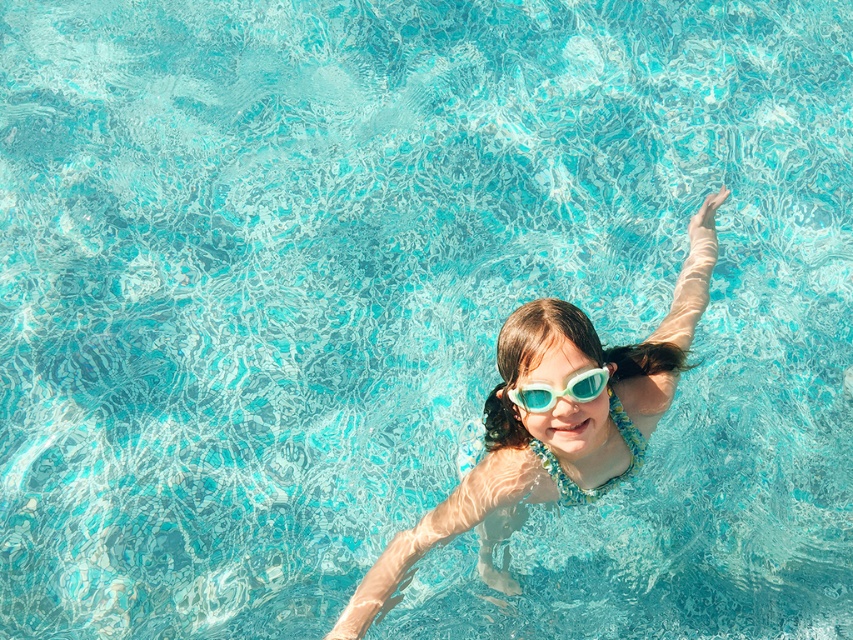
Question: Which point is closer to the camera taking this photo?

Choices:
 (A) (664, 336)
 (B) (527, 406)

Answer: (B)

Question: Among these points, which one is nearest to the camera?

Choices:
 (A) (628, 397)
 (B) (589, 380)

Answer: (B)

Question: Can you confirm if translucent plastic goggles at center is wider than clear plastic goggles at center?

Choices:
 (A) no
 (B) yes

Answer: (B)

Question: Is translucent plastic goggles at center smaller than clear plastic goggles at center?

Choices:
 (A) no
 (B) yes

Answer: (A)

Question: Which point is closer to the camera?

Choices:
 (A) translucent plastic goggles at center
 (B) clear plastic goggles at center

Answer: (B)

Question: Considering the relative positions of translucent plastic goggles at center and clear plastic goggles at center in the image provided, where is translucent plastic goggles at center located with respect to clear plastic goggles at center?

Choices:
 (A) left
 (B) right

Answer: (B)